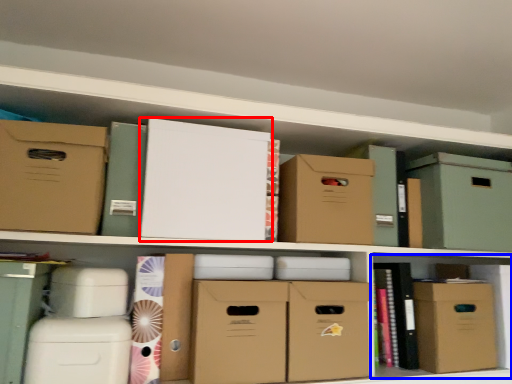
Question: Which object appears farthest to the camera in this image, cardboard box (highlighted by a red box) or cabinet (highlighted by a blue box)?

Choices:
 (A) cardboard box
 (B) cabinet

Answer: (B)